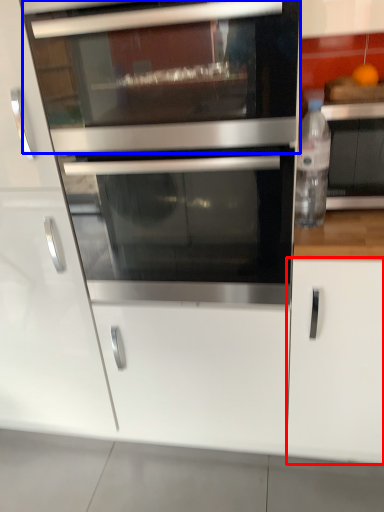
Question: Which of the following is the closest to the observer, cabinetry (highlighted by a red box) or microwave oven (highlighted by a blue box)?

Choices:
 (A) cabinetry
 (B) microwave oven

Answer: (B)